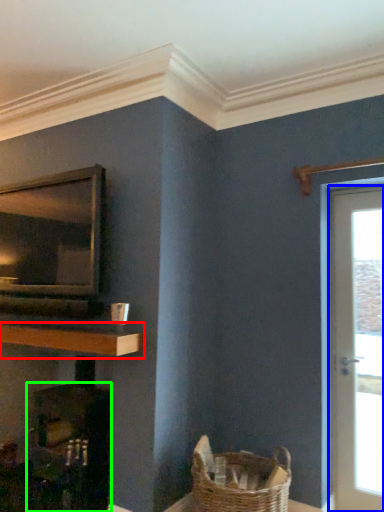
Question: Based on their relative distances, which object is nearer to shelf (highlighted by a red box)? Choose from door (highlighted by a blue box) and fireplace (highlighted by a green box).

Choices:
 (A) door
 (B) fireplace

Answer: (B)